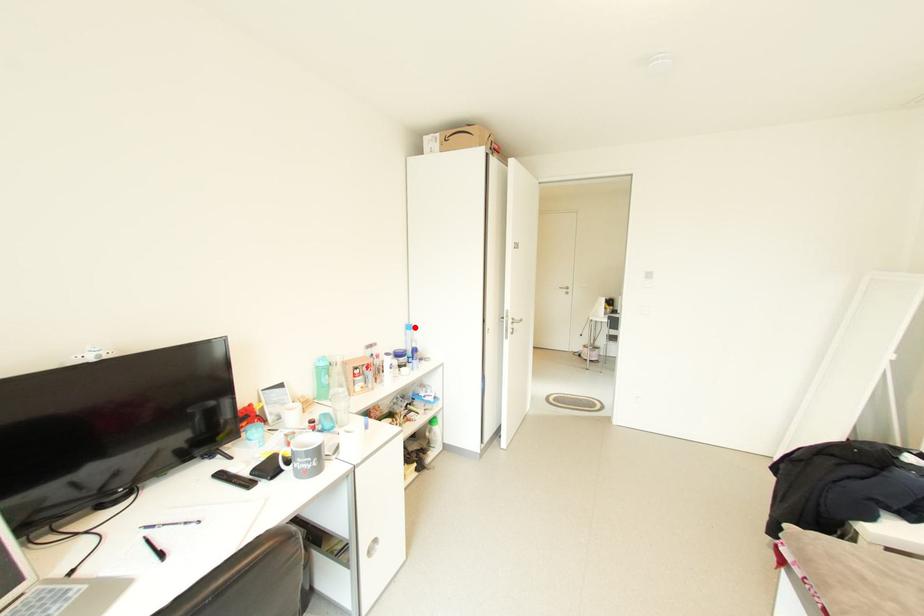
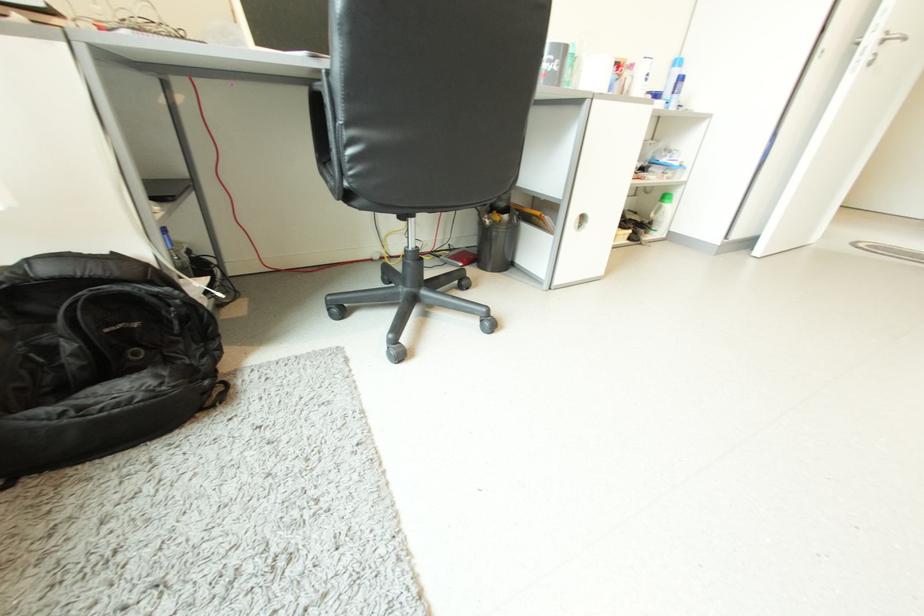
The point at the highlighted location is marked in the first image. Where is the corresponding point in the second image?

(681, 63)